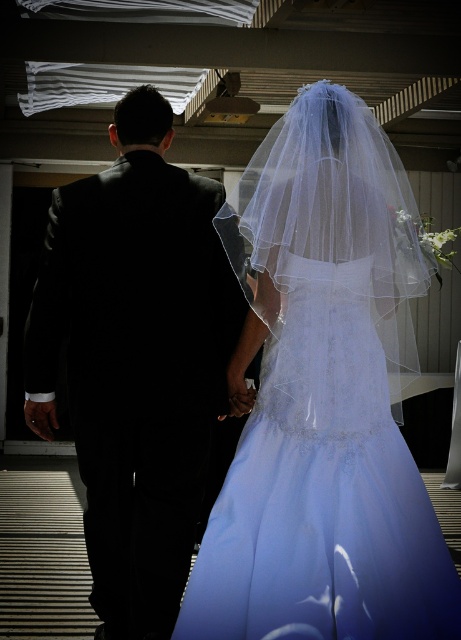
Image resolution: width=461 pixels, height=640 pixels. What are the coordinates of `translucent white veil at upper center` in the screenshot? It's located at (324, 397).

The height and width of the screenshot is (640, 461). Describe the element at coordinates (324, 397) in the screenshot. I see `translucent white veil at upper center` at that location.

In order to click on translucent white veil at upper center in this screenshot , I will do `click(324, 397)`.